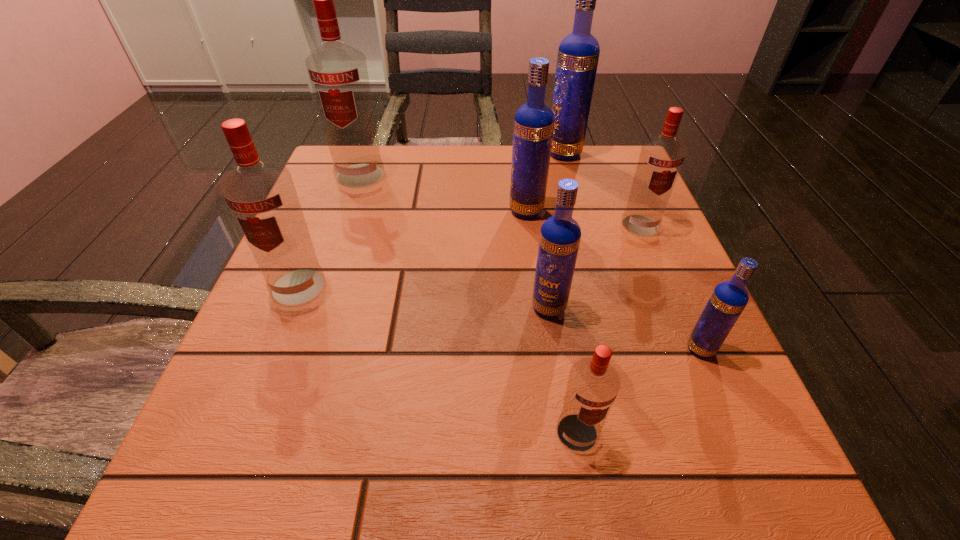
You are a GUI agent. You are given a task and a screenshot of the screen. Output one action in this format:
    pyautogui.click(x=<x>, y=<y>)
    Task: Click on the second blue vodka from right to left
    The image size is (960, 540).
    Given the screenshot: What is the action you would take?
    pyautogui.click(x=578, y=54)

I want to click on the biggest blue vodka, so click(578, 54).

Where is `the farthest red vodka`? This screenshot has height=540, width=960. the farthest red vodka is located at coordinates (338, 73).

The image size is (960, 540). I want to click on the biggest red vodka, so click(338, 73).

Where is `the third nearest blue vodka`? This screenshot has height=540, width=960. the third nearest blue vodka is located at coordinates (533, 128).

I want to click on the third smallest red vodka, so click(262, 197).

Identify the location of the second nearest blue vodka. 560,235.

I want to click on the rightmost red vodka, so click(661, 157).

You are a GUI agent. You are given a task and a screenshot of the screen. Output one action in this format:
    pyautogui.click(x=<x>, y=<y>)
    Task: Click on the second smallest red vodka
    The width and height of the screenshot is (960, 540).
    Given the screenshot: What is the action you would take?
    pyautogui.click(x=661, y=157)

The width and height of the screenshot is (960, 540). In order to click on the rightmost blue vodka in this screenshot , I will do `click(729, 298)`.